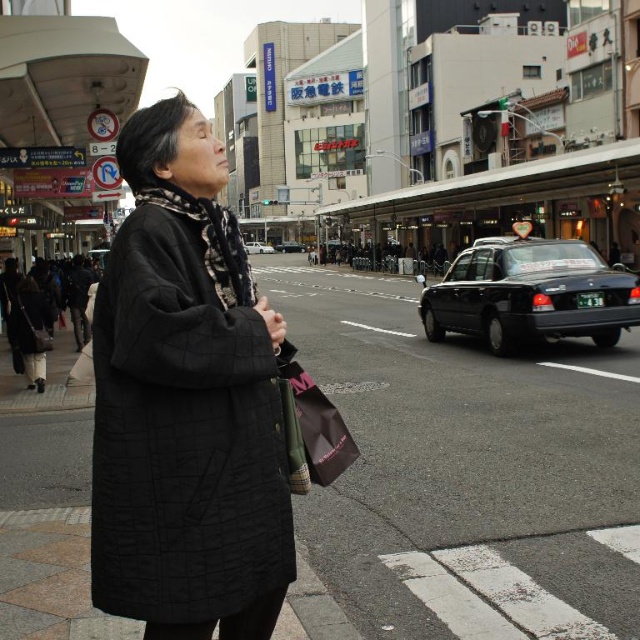
Based on the scene description, where is the matte black coat at center located in terms of its 2D coordinates?

The matte black coat at center is located at the 2D coordinates point (186,403).

You are a pedestrian standing on the sidewalk and see the matte black coat at center and the white matte taxi at center. Which object is closer to your right side?

The matte black coat at center is to the right of the white matte taxi at center, so the matte black coat at center is closer to your right side.